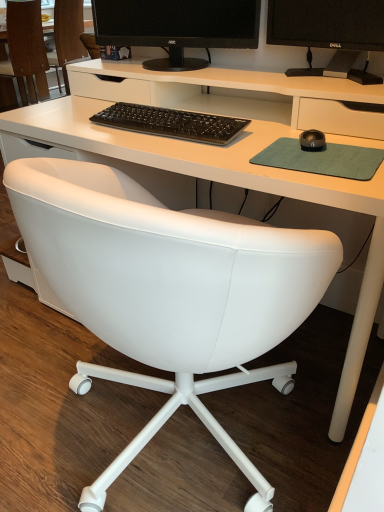
Locate an element on the screen. This screenshot has width=384, height=512. vacant area on top of green felt mousepad at right (from a real-world perspective) is located at coordinates (332, 152).